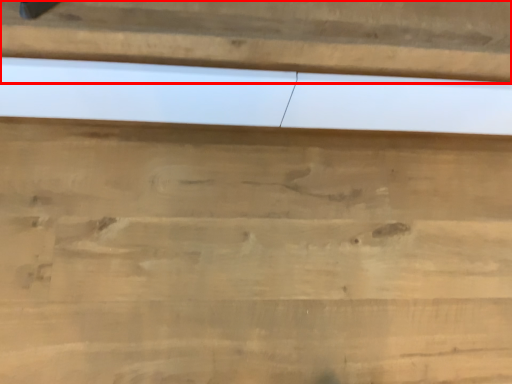
Question: From the image's perspective, where is panel (annotated by the red box) located relative to cutting board?

Choices:
 (A) above
 (B) below

Answer: (A)